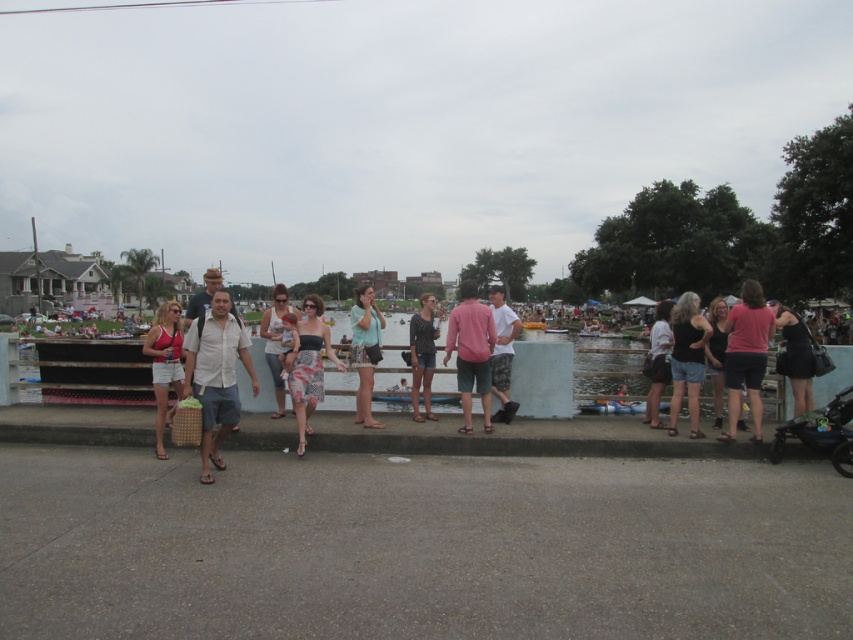
Who is positioned more to the right, white cotton shirt at center or pink cotton shirt at center?

pink cotton shirt at center

Between white cotton shirt at center and pink cotton shirt at center, which one appears on the left side from the viewer's perspective?

From the viewer's perspective, white cotton shirt at center appears more on the left side.

Consider the image. Who is more forward, (202,465) or (471,362)?

Point (202,465)

Identify the location of white cotton shirt at center. The width and height of the screenshot is (853, 640). (216, 374).

Is matte red tank top at center smaller than matte black shirt at center?

Indeed, matte red tank top at center has a smaller size compared to matte black shirt at center.

Is matte red tank top at center above matte black shirt at center?

Actually, matte red tank top at center is below matte black shirt at center.

Locate an element on the screen. matte red tank top at center is located at coordinates (164, 362).

Is matte black tank top at right to the left of matte black shirt at center from the viewer's perspective?

No, matte black tank top at right is not to the left of matte black shirt at center.

Does point (689, 413) lie behind point (415, 339)?

That is False.

Locate an element on the screen. This screenshot has width=853, height=640. matte black tank top at right is located at coordinates (688, 358).